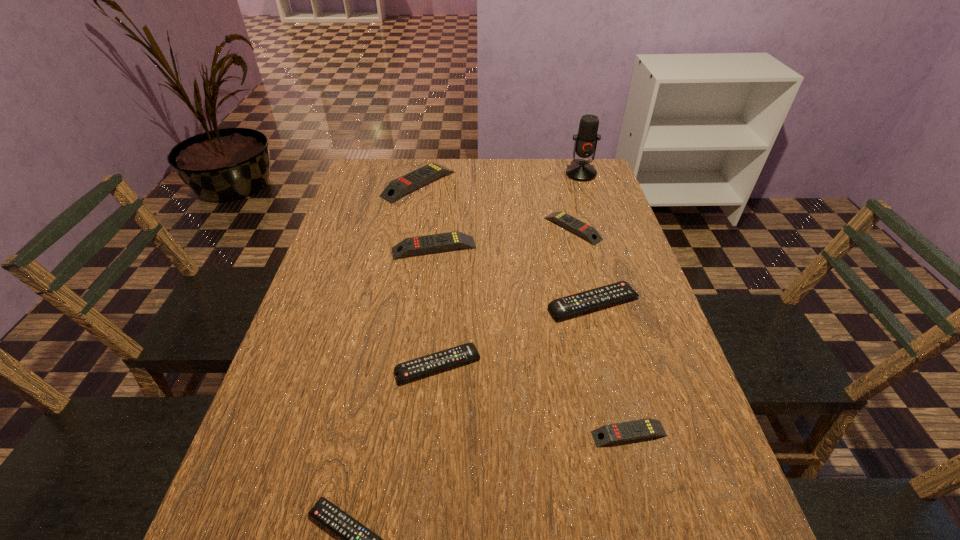
At what (x,y) coordinates should I click in order to perform the action: click on the second biggest black remote control. Please return your answer as a coordinate pair (x, y). This screenshot has width=960, height=540. Looking at the image, I should click on (444, 359).

Locate an element on the screen. This screenshot has height=540, width=960. the sixth farthest remote control is located at coordinates (608, 434).

Where is `the nearest yellow remote control`? Image resolution: width=960 pixels, height=540 pixels. the nearest yellow remote control is located at coordinates (608, 434).

Where is `vacant region located on the side of the microphone with the red ring`? This screenshot has height=540, width=960. vacant region located on the side of the microphone with the red ring is located at coordinates (592, 210).

Find the location of `blank space located 0.190m on the front of the second tallest object`. blank space located 0.190m on the front of the second tallest object is located at coordinates (408, 240).

At what (x,y) coordinates should I click in order to perform the action: click on vacant space located on the right of the second tallest remote control. Please return your answer as a coordinate pair (x, y). Image resolution: width=960 pixels, height=540 pixels. Looking at the image, I should click on (566, 248).

Identify the location of vacant space located on the front of the second smallest yellow remote control. (597, 324).

This screenshot has width=960, height=540. In order to click on vacant area situated 0.200m on the back of the rightmost black remote control in this screenshot , I will do `click(577, 239)`.

The height and width of the screenshot is (540, 960). I want to click on free space located 0.070m on the front of the third nearest remote control, so click(x=434, y=416).

The height and width of the screenshot is (540, 960). In order to click on vacant area located on the back of the sixth farthest remote control in this screenshot , I will do `click(609, 356)`.